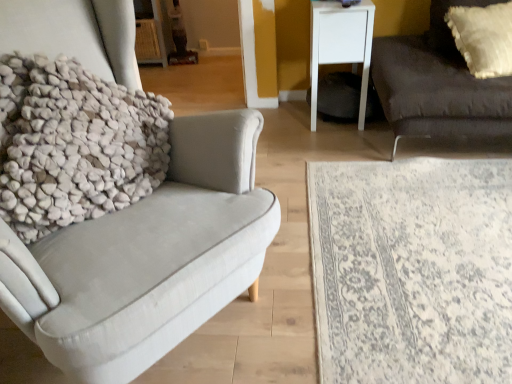
What do you see at coordinates (74, 144) in the screenshot?
I see `white textured pillow at left` at bounding box center [74, 144].

Measure the distance between white matte side table at upper right and camera.

A distance of 6.98 feet exists between white matte side table at upper right and camera.

This screenshot has width=512, height=384. I want to click on white textured pillow at left, so click(74, 144).

Based on the photo, considering the relative sizes of white matte side table at upper right and white textured pillow at left in the image provided, is white matte side table at upper right shorter than white textured pillow at left?

No.

Which object is further away from the camera, white matte side table at upper right or white textured pillow at left?

white matte side table at upper right is behind.

Looking at this image, which of these two, white matte side table at upper right or white textured pillow at left, is wider?

white matte side table at upper right.

Looking at this image, measure the distance between white textured pillow at upper right and white matte side table at upper right.

white textured pillow at upper right is 21.93 inches from white matte side table at upper right.

Does white textured pillow at upper right have a lesser width compared to white matte side table at upper right?

Yes.

From the image's perspective, is white textured pillow at upper right positioned above or below white matte side table at upper right?

white textured pillow at upper right is situated lower than white matte side table at upper right in the image.

Consider the image. Is white textured pillow at upper right located outside white matte side table at upper right?

white textured pillow at upper right lies outside white matte side table at upper right's area.

Can you tell me how much dark gray fabric couch at right and white textured pillow at upper right differ in facing direction?

The angle between the facing direction of dark gray fabric couch at right and the facing direction of white textured pillow at upper right is 3.55 degrees.

This screenshot has height=384, width=512. I want to click on studio couch on the left side of white textured pillow at upper right, so click(438, 84).

In the image, is dark gray fabric couch at right on the left side or the right side of white textured pillow at upper right?

dark gray fabric couch at right is to the left of white textured pillow at upper right.

What's the angular difference between white textured pillow at left and white textured pillow at upper right's facing directions?

white textured pillow at left and white textured pillow at upper right are facing 67.8 degrees away from each other.

From a real-world perspective, is white textured pillow at left positioned above or below white textured pillow at upper right?

In terms of real-world spatial position, white textured pillow at left is above white textured pillow at upper right.

From the image's perspective, relative to white textured pillow at upper right, is white textured pillow at left above or below?

Clearly, from the image's perspective, white textured pillow at left is below white textured pillow at upper right.

Between white textured pillow at left and white textured pillow at upper right, which one appears on the left side from the viewer's perspective?

white textured pillow at left is more to the left.

Does dark gray fabric couch at right appear on the left side of white matte side table at upper right?

In fact, dark gray fabric couch at right is to the right of white matte side table at upper right.

Which object is closer to the camera taking this photo, dark gray fabric couch at right or white matte side table at upper right?

Positioned in front is dark gray fabric couch at right.

Is point (422, 129) positioned before point (313, 59)?

Yes, point (422, 129) is in front of point (313, 59).

From a real-world perspective, which is physically below, dark gray fabric couch at right or white matte side table at upper right?

white matte side table at upper right.

Locate an element on the screen. This screenshot has height=384, width=512. plain below the white matte side table at upper right (from the image's perspective) is located at coordinates (412, 270).

Can you confirm if white matte side table at upper right is wider than white textured rug at lower right?

In fact, white matte side table at upper right might be narrower than white textured rug at lower right.

From the picture: Relative to white textured rug at lower right, is white matte side table at upper right in front or behind?

Visually, white matte side table at upper right is located behind white textured rug at lower right.

From a real-world perspective, does white matte side table at upper right stand above dark gray fabric couch at right?

No.

Can we say white matte side table at upper right lies outside dark gray fabric couch at right?

white matte side table at upper right is positioned outside dark gray fabric couch at right.

Can you confirm if white matte side table at upper right is bigger than dark gray fabric couch at right?

Incorrect, white matte side table at upper right is not larger than dark gray fabric couch at right.

Locate an element on the screen. This screenshot has width=512, height=384. table to the right of white textured pillow at left is located at coordinates (341, 45).

Image resolution: width=512 pixels, height=384 pixels. What are the coordinates of `table located behind the white textured pillow at upper right` in the screenshot? It's located at (341, 45).

From the image, which object appears to be nearer to white textured rug at lower right, white textured pillow at left or white matte side table at upper right?

The object closer to white textured rug at lower right is white textured pillow at left.

Estimate the real-world distances between objects in this image. Which object is closer to white matte side table at upper right, dark gray fabric couch at right or white textured pillow at upper right?

dark gray fabric couch at right.

Looking at the image, which one is located further to white textured pillow at left, dark gray fabric couch at right or white matte side table at upper right?

The object further to white textured pillow at left is white matte side table at upper right.

Considering their positions, is dark gray fabric couch at right positioned further to white textured pillow at upper right than white matte side table at upper right?

Among the two, white matte side table at upper right is located further to white textured pillow at upper right.

Estimate the real-world distances between objects in this image. Which object is further from white textured pillow at left, white textured pillow at upper right or dark gray fabric couch at right?

white textured pillow at upper right is positioned further to the anchor white textured pillow at left.

Based on their spatial positions, is white matte side table at upper right or dark gray fabric couch at right further from white textured pillow at upper right?

Among the two, white matte side table at upper right is located further to white textured pillow at upper right.

Based on their spatial positions, is dark gray fabric couch at right or white textured rug at lower right closer to white textured pillow at upper right?

dark gray fabric couch at right is closer to white textured pillow at upper right.

Which object lies nearer to the anchor point white textured pillow at left, white textured rug at lower right or dark gray fabric couch at right?

white textured rug at lower right is closer to white textured pillow at left.

You are a GUI agent. You are given a task and a screenshot of the screen. Output one action in this format:
    pyautogui.click(x=<x>, y=<y>)
    Task: Click on the plain between white textured pillow at left and white textured pillow at upper right from left to right
    
    Given the screenshot: What is the action you would take?
    pyautogui.click(x=412, y=270)

Identify the location of plain between white textured pillow at left and dark gray fabric couch at right from left to right. This screenshot has width=512, height=384. (412, 270).

You are a GUI agent. You are given a task and a screenshot of the screen. Output one action in this format:
    pyautogui.click(x=<x>, y=<y>)
    Task: Click on the studio couch between white textured pillow at upper right and white textured rug at lower right vertically
    The height and width of the screenshot is (384, 512).
    Given the screenshot: What is the action you would take?
    pyautogui.click(x=438, y=84)

You are a GUI agent. You are given a task and a screenshot of the screen. Output one action in this format:
    pyautogui.click(x=<x>, y=<y>)
    Task: Click on the studio couch between white matte side table at upper right and white textured rug at lower right vertically
    
    Given the screenshot: What is the action you would take?
    pyautogui.click(x=438, y=84)